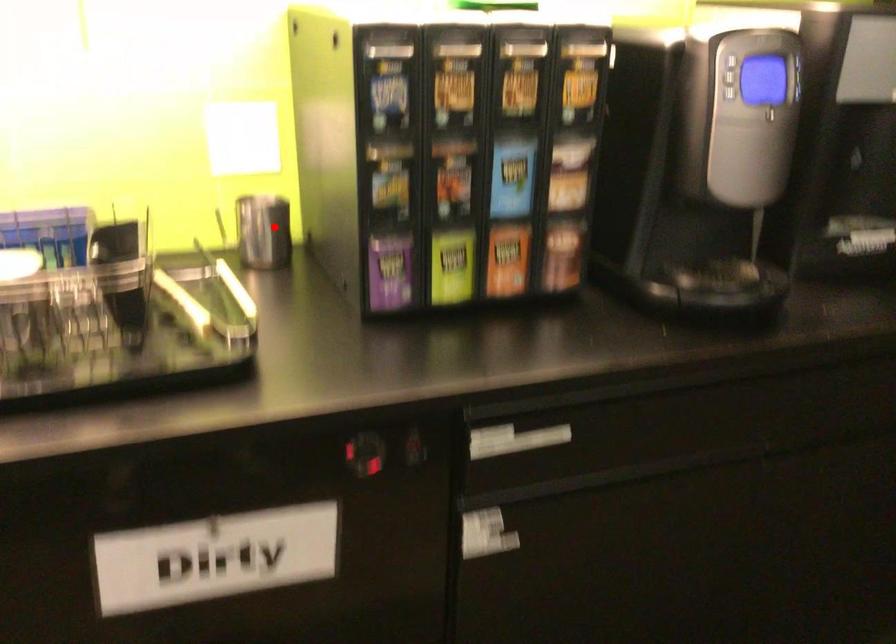
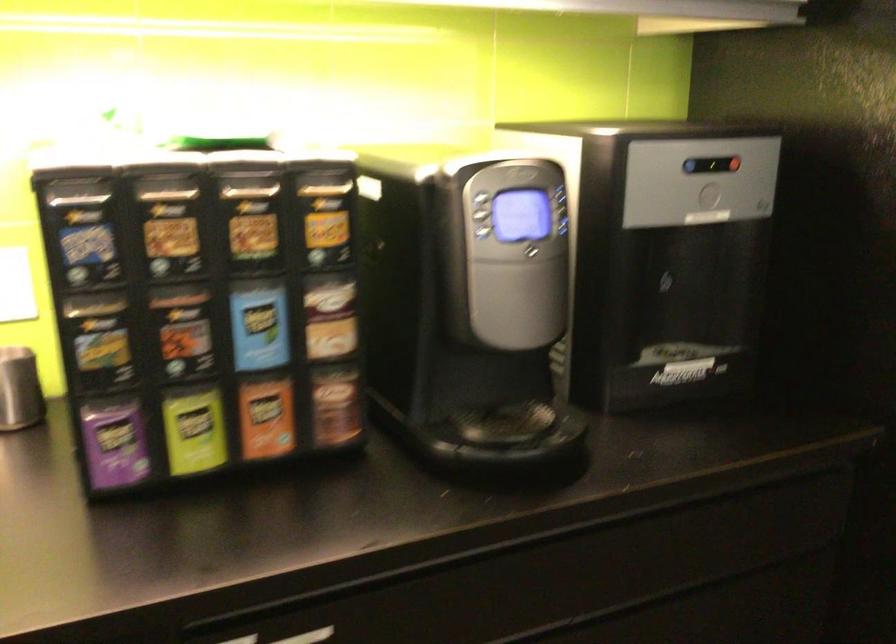
Find the pixel in the second image that matches the highlighted location in the first image.

(19, 389)